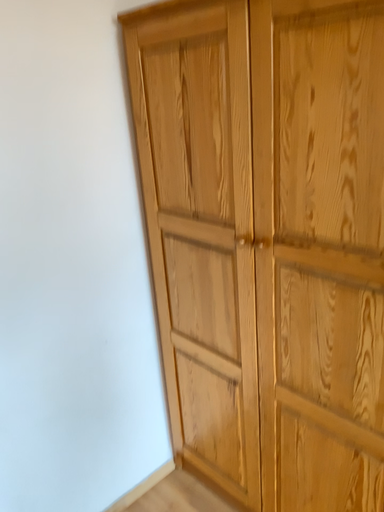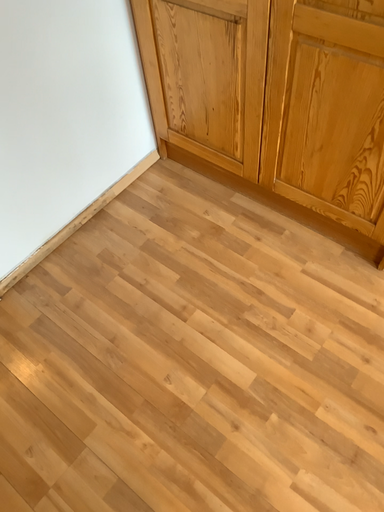
Question: Which way did the camera rotate in the video?

Choices:
 (A) rotated downward
 (B) rotated upward

Answer: (A)